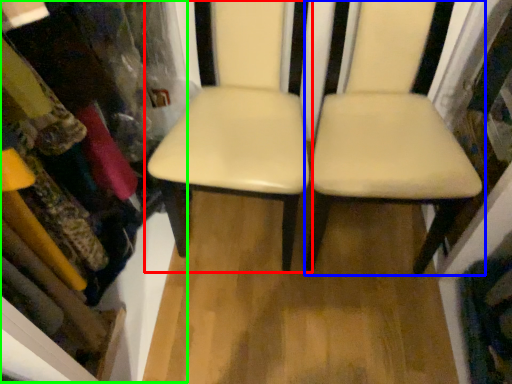
Question: Considering the real-world distances, which object is closest to chair (highlighted by a red box)? chair (highlighted by a blue box) or bookshelf (highlighted by a green box).

Choices:
 (A) chair
 (B) bookshelf

Answer: (A)